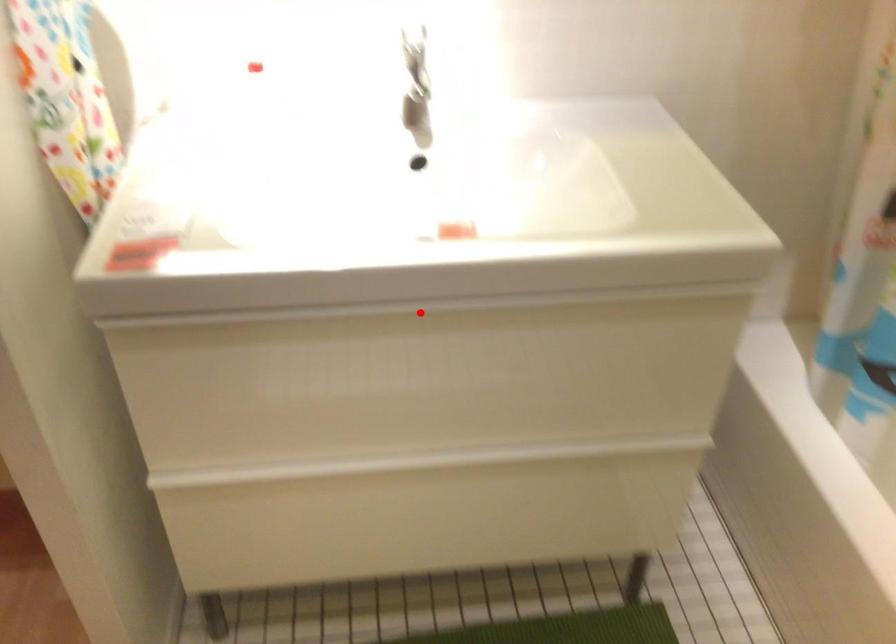
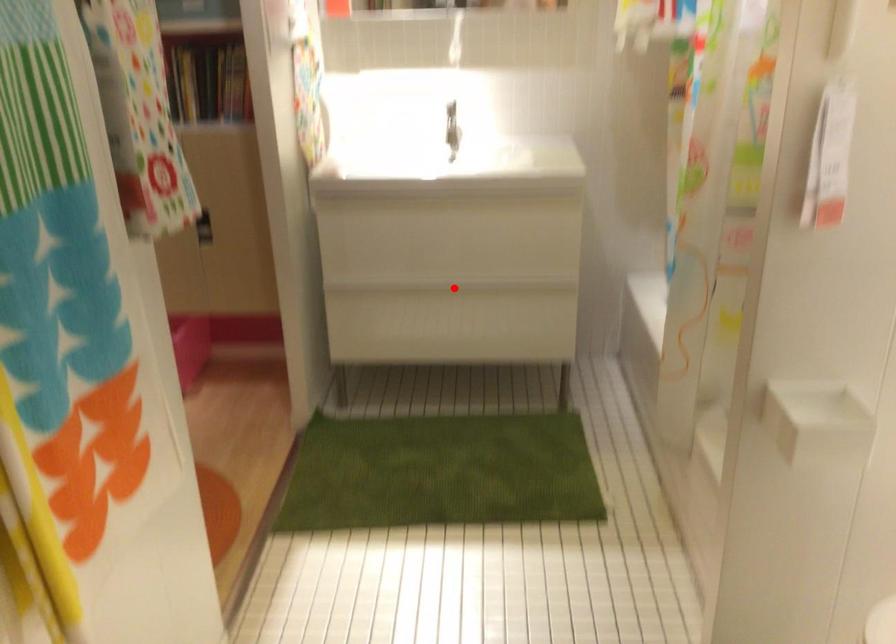
I am providing you with two images of the same scene from different viewpoints. A red point is marked on the first image and another point is marked on the second image. Does the point marked in image1 correspond to the same location as the one in image2?

No